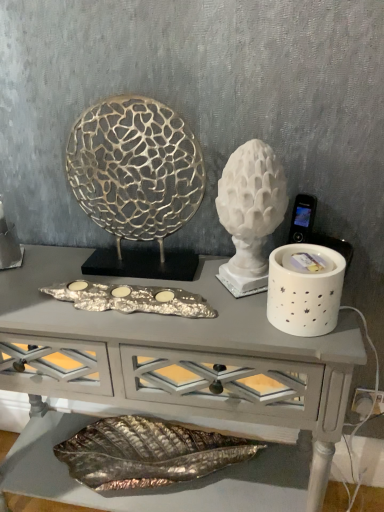
What are the coordinates of `blank space above white glossy candle holder at upper right (from a real-world perspective)` in the screenshot? It's located at [x=118, y=278].